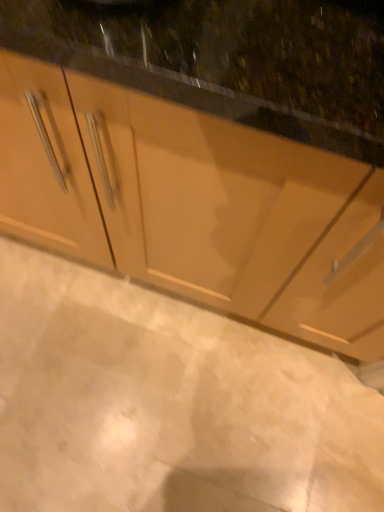
Locate an element on the screen. white marble floor at lower center is located at coordinates (168, 404).

This screenshot has height=512, width=384. Describe the element at coordinates (168, 404) in the screenshot. I see `white marble floor at lower center` at that location.

Image resolution: width=384 pixels, height=512 pixels. Find the location of `matte wood cabinet at center`. matte wood cabinet at center is located at coordinates (200, 206).

What do you see at coordinates (200, 206) in the screenshot? I see `matte wood cabinet at center` at bounding box center [200, 206].

Locate an element on the screen. The height and width of the screenshot is (512, 384). white marble floor at lower center is located at coordinates (168, 404).

Based on the photo, in the image, is matte wood cabinet at center on the left side or the right side of white marble floor at lower center?

From the image, it's evident that matte wood cabinet at center is to the right of white marble floor at lower center.

Which is behind, matte wood cabinet at center or white marble floor at lower center?

white marble floor at lower center is further away from the camera.

Considering the points (13, 154) and (283, 351), which point is in front, point (13, 154) or point (283, 351)?

The point (13, 154) is closer to the camera.

From the image's perspective, does matte wood cabinet at center appear lower than white marble floor at lower center?

No.

From a real-world perspective, which is physically above, matte wood cabinet at center or white marble floor at lower center?

matte wood cabinet at center.

Which of these two, matte wood cabinet at center or white marble floor at lower center, is thinner?

Thinner between the two is white marble floor at lower center.

Looking at this image, considering the relative sizes of matte wood cabinet at center and white marble floor at lower center in the image provided, is matte wood cabinet at center shorter than white marble floor at lower center?

No, matte wood cabinet at center is not shorter than white marble floor at lower center.

In terms of size, does matte wood cabinet at center appear bigger or smaller than white marble floor at lower center?

matte wood cabinet at center is bigger than white marble floor at lower center.

Which is correct: matte wood cabinet at center is inside white marble floor at lower center, or outside of it?

matte wood cabinet at center is not enclosed by white marble floor at lower center.

Is matte wood cabinet at center placed right next to white marble floor at lower center?

No, matte wood cabinet at center is not in contact with white marble floor at lower center.

Is matte wood cabinet at center turned away from white marble floor at lower center?

No, white marble floor at lower center is not at the back of matte wood cabinet at center.

How far apart are matte wood cabinet at center and white marble floor at lower center?

matte wood cabinet at center is 16.81 inches from white marble floor at lower center.

The height and width of the screenshot is (512, 384). I want to click on granite behind the matte wood cabinet at center, so click(168, 404).

Is white marble floor at lower center to the right of matte wood cabinet at center from the viewer's perspective?

No, white marble floor at lower center is not to the right of matte wood cabinet at center.

Relative to matte wood cabinet at center, is white marble floor at lower center in front or behind?

In the image, white marble floor at lower center appears behind matte wood cabinet at center.

Is point (92, 498) closer to viewer compared to point (339, 223)?

That is False.

From the image's perspective, is white marble floor at lower center on matte wood cabinet at center?

No.

From a real-world perspective, is white marble floor at lower center on top of matte wood cabinet at center?

Actually, white marble floor at lower center is physically below matte wood cabinet at center in the real world.

Considering the sizes of objects white marble floor at lower center and matte wood cabinet at center in the image provided, who is wider, white marble floor at lower center or matte wood cabinet at center?

matte wood cabinet at center.

Can you confirm if white marble floor at lower center is shorter than matte wood cabinet at center?

Indeed, white marble floor at lower center has a lesser height compared to matte wood cabinet at center.

Which of these two, white marble floor at lower center or matte wood cabinet at center, is smaller?

white marble floor at lower center is smaller.

Is matte wood cabinet at center completely or partially inside white marble floor at lower center?

No, white marble floor at lower center does not contain matte wood cabinet at center.

Is white marble floor at lower center positioned far away from matte wood cabinet at center?

No, white marble floor at lower center is in close proximity to matte wood cabinet at center.

Is white marble floor at lower center positioned with its back to matte wood cabinet at center?

No, white marble floor at lower center is not facing the opposite direction of matte wood cabinet at center.

How many degrees apart are the facing directions of white marble floor at lower center and matte wood cabinet at center?

There is a 0.584-degree angle between the facing directions of white marble floor at lower center and matte wood cabinet at center.

The width and height of the screenshot is (384, 512). What are the coordinates of `granite on the left of matte wood cabinet at center` in the screenshot? It's located at (168, 404).

Locate an element on the screen. granite below the matte wood cabinet at center (from the image's perspective) is located at coordinates pos(168,404).

The image size is (384, 512). In order to click on cabinetry positioned vertically above the white marble floor at lower center (from a real-world perspective) in this screenshot , I will do `click(200, 206)`.